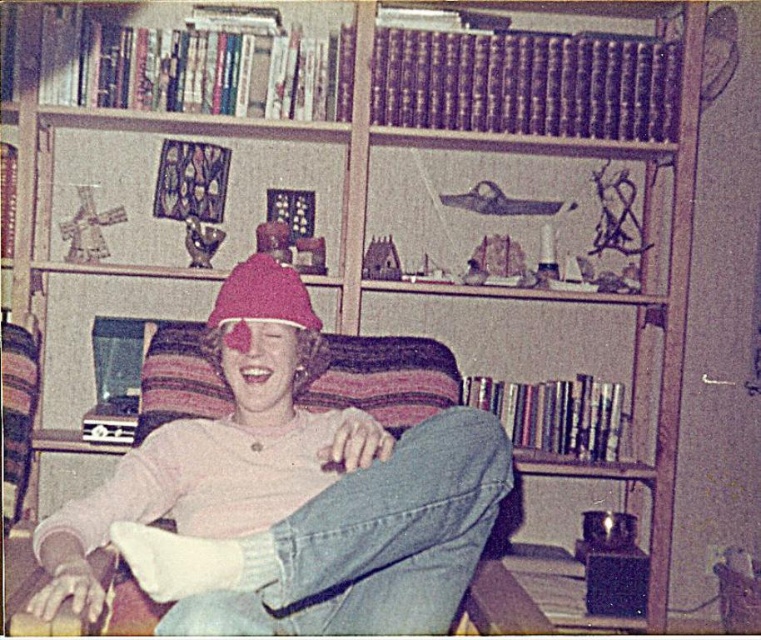
You are a tailor measuring the width of two hats in the image. The hats are the pink matte hat at center and the fuzzy pink beanie at center. According to the description, which hat is wider?

The pink matte hat at center is wider than the fuzzy pink beanie at center according to the description.

You are a delivery robot with a package that is 1.1 meters wide. You need to deliver it through the space between the pink matte hat at center and the striped armchair. Can you fit through that space?

The space between the pink matte hat at center and the striped armchair is 1.09 meters, which is narrower than the package width of 1.1 meters. The robot cannot fit through the space.

You are standing in the room and see the striped armchair and the point marked at coordinate (288,493). Which object is closer to you, the striped armchair or the pink matte hat at center?

The pink matte hat at center is closer to you because the point marked at coordinate (288,493) indicates its location, which is at the center of the image, whereas the striped armchair is positioned further back in the scene.